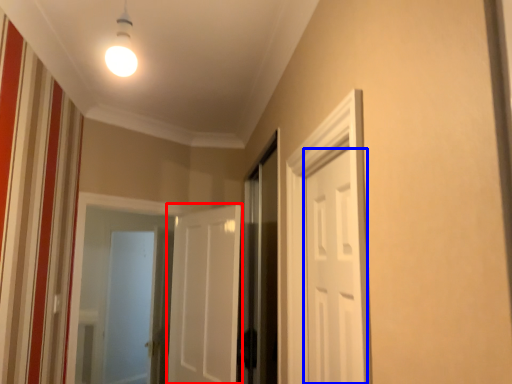
Question: Which object is closer to the camera taking this photo, door (highlighted by a red box) or door (highlighted by a blue box)?

Choices:
 (A) door
 (B) door

Answer: (B)